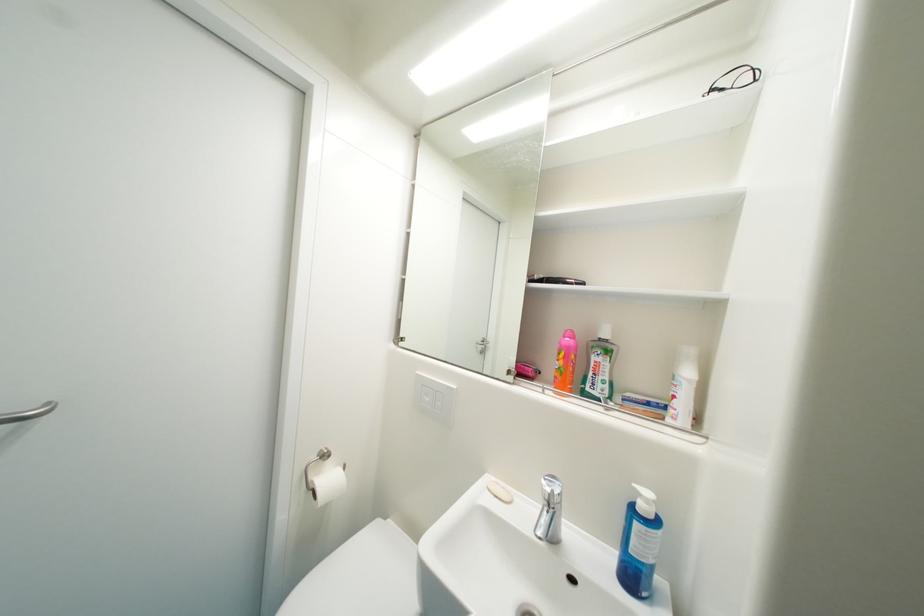
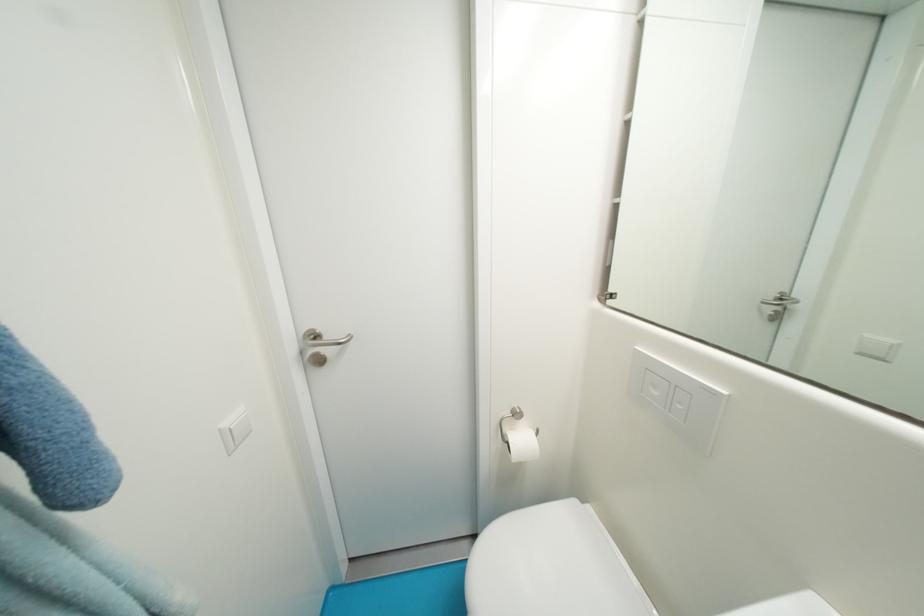
Where in the second image is the point corresponding to (433,400) from the first image?

(662, 395)